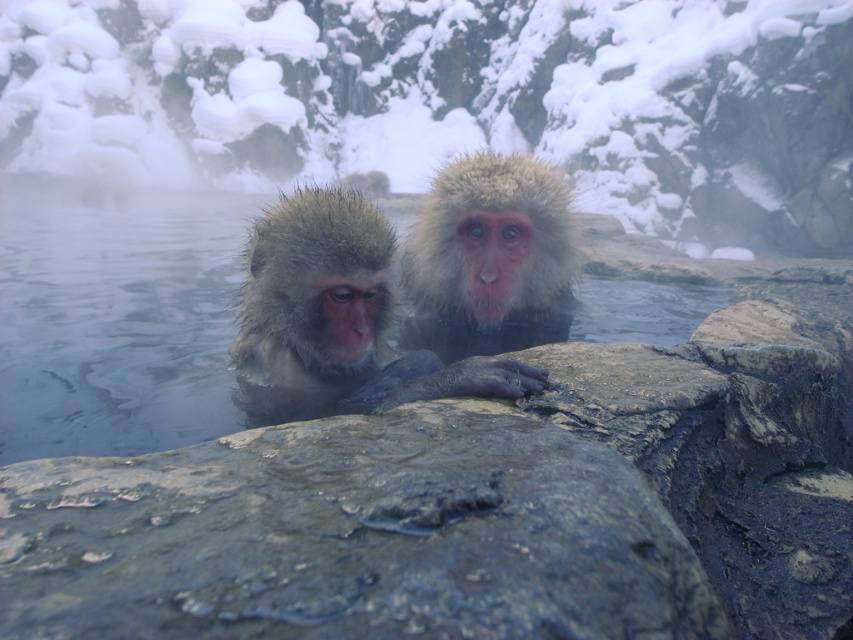
Image resolution: width=853 pixels, height=640 pixels. What do you see at coordinates (316, 308) in the screenshot?
I see `fuzzy fur monkey at center` at bounding box center [316, 308].

Which is below, fuzzy fur monkey at center or fuzzy white fur monkey at center?

fuzzy fur monkey at center

Is point (320, 353) positioned before point (442, 314)?

That is True.

Where is `fuzzy fur monkey at center`? fuzzy fur monkey at center is located at coordinates (316, 308).